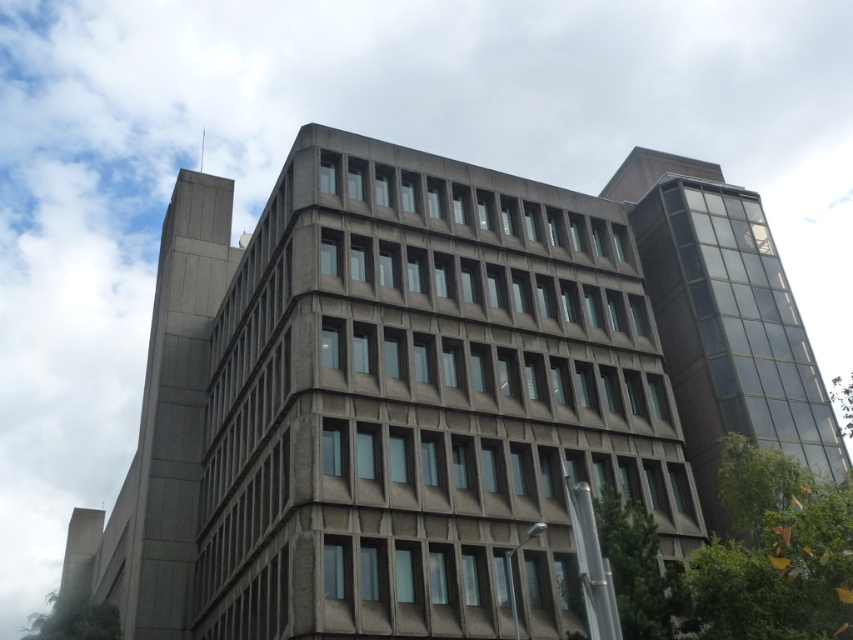
You are an architect reviewing the building design. You need to determine which tower, the dark glass tower at right or the gray concrete tower at upper left, requires more structural support due to its size. Which one should you prioritize?

The gray concrete tower at upper left requires more structural support because it is larger in size compared to the dark glass tower at right.

You are standing in front of the modern multi story building and want to determine the relative positions of two points marked on its facade. The points are labeled as point (202, 531) and point (115, 556). Which point is closer to you?

Point (202, 531) is closer to the viewer than point (115, 556).

You are a delivery drone with a maximum flight altitude of 30 meters. You need to deliver a package to the gray concrete building at center. Can you reach the building without exceeding your altitude limit?

The gray concrete building at center is 33.84 meters tall. Since your drone has a maximum flight altitude of 30 meters, you cannot reach the building without exceeding your altitude limit.